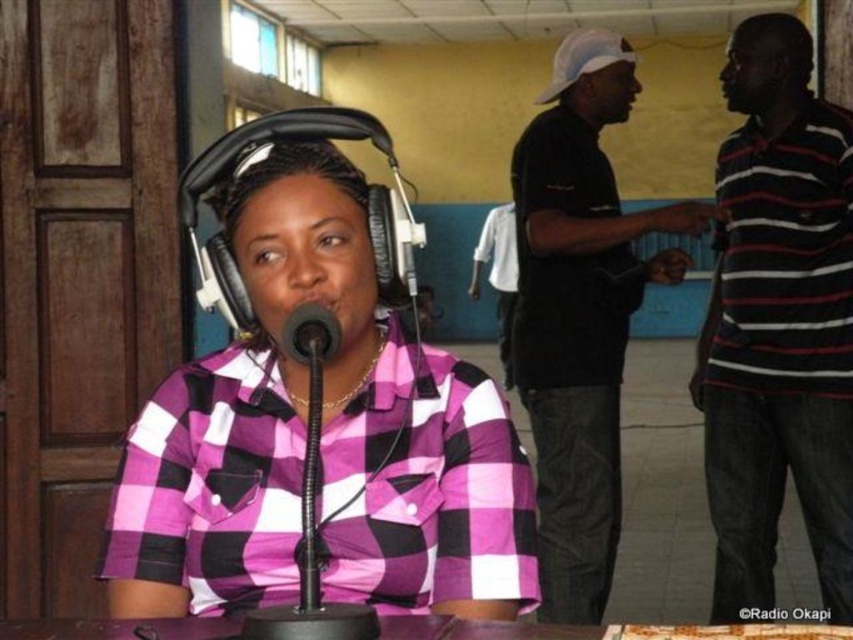
You are standing in a radio station and want to know how far the point at coordinates (x=759, y=381) is from your current position. Can you determine the distance?

The point at coordinates (x=759, y=381) is 2.49 meters away from the camera, so the distance from your current position would depend on where you are standing in the radio station.

You are standing at the entrance of the radio station and see two points marked in the scene. The first point is at coordinates point (436, 394) and the second is at point (554, 564). If you want to walk from the entrance to the first point, will you pass by the second point along the way?

Since point (436, 394) is in front of point (554, 564), walking towards the first point would mean you are approaching it directly without passing by the second point. Therefore, you would not pass by the second point on your way to the first point.

Based on the photo, you are a sound technician in the studio. You need to place a 1.5 meter long microphone cable between the pink checkered shirt at center and the black matte shirt at upper right. Will the cable reach both shirts without needing to extend it further?

The distance between the pink checkered shirt at center and the black matte shirt at upper right is 1.49 meters. Since the microphone cable is 1.5 meters long, it will reach both shirts with a small amount of slack remaining.